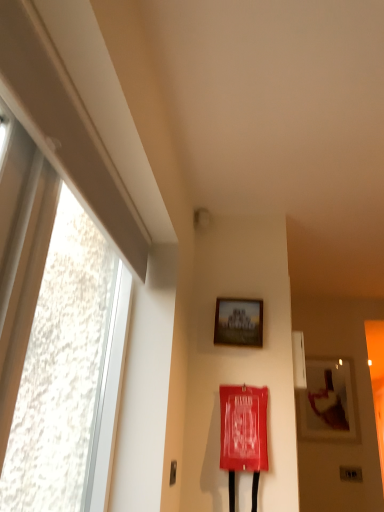
This screenshot has width=384, height=512. Describe the element at coordinates (173, 472) in the screenshot. I see `metallic silver door handle at lower left` at that location.

Where is `transparent glass window at left`? Image resolution: width=384 pixels, height=512 pixels. transparent glass window at left is located at coordinates (56, 356).

Describe the element at coordinates (56, 356) in the screenshot. The image size is (384, 512). I see `transparent glass window at left` at that location.

I want to click on matte wooden picture frame at upper center, the 2th picture frame from the right, so click(239, 322).

Locate an element on the screen. metallic silver door handle at lower left is located at coordinates tap(173, 472).

Considering the relative sizes of wooden picture frame at upper right, which is the 2th picture frame from front to back, and transparent glass window at left in the image provided, is wooden picture frame at upper right, which is the 2th picture frame from front to back, thinner than transparent glass window at left?

Correct, the width of wooden picture frame at upper right, which is the 2th picture frame from front to back, is less than that of transparent glass window at left.

Is wooden picture frame at upper right, which is counted as the 2th picture frame, starting from the left, bigger or smaller than transparent glass window at left?

Clearly, wooden picture frame at upper right, which is counted as the 2th picture frame, starting from the left, is smaller in size than transparent glass window at left.

Who is more distant, wooden picture frame at upper right, acting as the first picture frame starting from the right, or transparent glass window at left?

wooden picture frame at upper right, acting as the first picture frame starting from the right, is behind.

This screenshot has height=512, width=384. Identify the location of window that is on the left side of wooden picture frame at upper right, acting as the first picture frame starting from the back. (56, 356).

Considering the sizes of objects transparent glass window at left and wooden picture frame at upper right, which is the 2th picture frame from front to back, in the image provided, who is shorter, transparent glass window at left or wooden picture frame at upper right, which is the 2th picture frame from front to back,?

With less height is wooden picture frame at upper right, which is the 2th picture frame from front to back.

Which of these two, transparent glass window at left or wooden picture frame at upper right, placed as the 1th picture frame when sorted from bottom to top, is smaller?

wooden picture frame at upper right, placed as the 1th picture frame when sorted from bottom to top.

Is transparent glass window at left situated inside wooden picture frame at upper right, which appears as the second picture frame when viewed from the top, or outside?

transparent glass window at left is spatially situated outside wooden picture frame at upper right, which appears as the second picture frame when viewed from the top.

Would you say metallic silver door handle at lower left is to the left or to the right of wooden picture frame at upper right, acting as the first picture frame starting from the right, in the picture?

From the image, it's evident that metallic silver door handle at lower left is to the left of wooden picture frame at upper right, acting as the first picture frame starting from the right.

Can you confirm if metallic silver door handle at lower left is thinner than wooden picture frame at upper right, which is the 2th picture frame from front to back?

Correct, the width of metallic silver door handle at lower left is less than that of wooden picture frame at upper right, which is the 2th picture frame from front to back.

The image size is (384, 512). What are the coordinates of `door handle in front of the wooden picture frame at upper right, which is counted as the 2th picture frame, starting from the left` in the screenshot? It's located at [173, 472].

From the picture: From the image's perspective, which is above, metallic silver door handle at lower left or wooden picture frame at upper right, placed as the 1th picture frame when sorted from bottom to top?

metallic silver door handle at lower left, from the image's perspective.

From the image's perspective, which is above, matte wooden picture frame at upper center, the first picture frame when ordered from left to right, or wooden picture frame at upper right, which is counted as the 2th picture frame, starting from the left?

matte wooden picture frame at upper center, the first picture frame when ordered from left to right, from the image's perspective.

Can you confirm if matte wooden picture frame at upper center, the first picture frame from the top, is thinner than wooden picture frame at upper right, acting as the first picture frame starting from the back?

Incorrect, the width of matte wooden picture frame at upper center, the first picture frame from the top, is not less than that of wooden picture frame at upper right, acting as the first picture frame starting from the back.

Is the position of matte wooden picture frame at upper center, which is the 2th picture frame in back-to-front order, more distant than that of wooden picture frame at upper right, which is the 2th picture frame from front to back?

No, it is not.

Is matte wooden picture frame at upper center, which is the 2th picture frame in back-to-front order, not inside wooden picture frame at upper right, acting as the first picture frame starting from the back?

Yes.

Considering the sizes of wooden picture frame at upper right, which is the 2th picture frame from front to back, and matte wooden picture frame at upper center, the 2th picture frame from the right, in the image, is wooden picture frame at upper right, which is the 2th picture frame from front to back, wider or thinner than matte wooden picture frame at upper center, the 2th picture frame from the right,?

Clearly, wooden picture frame at upper right, which is the 2th picture frame from front to back, has less width compared to matte wooden picture frame at upper center, the 2th picture frame from the right.

Is wooden picture frame at upper right, placed as the 1th picture frame when sorted from bottom to top, not within matte wooden picture frame at upper center, which is the 1th picture frame from front to back?

Yes, wooden picture frame at upper right, placed as the 1th picture frame when sorted from bottom to top, is outside of matte wooden picture frame at upper center, which is the 1th picture frame from front to back.

Are wooden picture frame at upper right, which is the 2th picture frame from front to back, and matte wooden picture frame at upper center, the first picture frame from the top, located far from each other?

Indeed, wooden picture frame at upper right, which is the 2th picture frame from front to back, is not near matte wooden picture frame at upper center, the first picture frame from the top.

Could you tell me if wooden picture frame at upper right, which appears as the second picture frame when viewed from the top, is turned towards matte wooden picture frame at upper center, the 2th picture frame from the right?

Yes, wooden picture frame at upper right, which appears as the second picture frame when viewed from the top, is aimed at matte wooden picture frame at upper center, the 2th picture frame from the right.

Are matte wooden picture frame at upper center, which is counted as the second picture frame, starting from the bottom, and transparent glass window at left located far from each other?

No, there isn't a large distance between matte wooden picture frame at upper center, which is counted as the second picture frame, starting from the bottom, and transparent glass window at left.

From the image's perspective, which is below, matte wooden picture frame at upper center, which is the 2th picture frame in back-to-front order, or transparent glass window at left?

matte wooden picture frame at upper center, which is the 2th picture frame in back-to-front order, appears lower in the image.

Would you say matte wooden picture frame at upper center, the first picture frame from the top, is inside or outside transparent glass window at left?

matte wooden picture frame at upper center, the first picture frame from the top, is not inside transparent glass window at left, it's outside.

Is point (257, 300) farther from camera compared to point (104, 327)?

Yes, it is.

Is metallic silver door handle at lower left turned away from transparent glass window at left?

No, metallic silver door handle at lower left's orientation is not away from transparent glass window at left.

At what (x,y) coordinates should I click in order to perform the action: click on door handle below the transparent glass window at left (from the image's perspective). Please return your answer as a coordinate pair (x, y). This screenshot has height=512, width=384. Looking at the image, I should click on (173, 472).

Is metallic silver door handle at lower left positioned far away from transparent glass window at left?

That's not correct — metallic silver door handle at lower left is a little close to transparent glass window at left.

Is metallic silver door handle at lower left taller or shorter than transparent glass window at left?

metallic silver door handle at lower left is shorter than transparent glass window at left.

The image size is (384, 512). In order to click on window that appears on the left of wooden picture frame at upper right, which appears as the second picture frame when viewed from the top in this screenshot , I will do `click(56, 356)`.

The image size is (384, 512). What are the coordinates of `the 1st picture frame above the transparent glass window at left (from a real-world perspective)` in the screenshot? It's located at (327, 401).

From the image, which object appears to be nearer to metallic silver door handle at lower left, transparent glass window at left or wooden picture frame at upper right, acting as the first picture frame starting from the right?

Based on the image, transparent glass window at left appears to be nearer to metallic silver door handle at lower left.

Which object lies nearer to the anchor point matte wooden picture frame at upper center, the 2th picture frame from the right, wooden picture frame at upper right, which is the 2th picture frame from front to back, or transparent glass window at left?

Among the two, transparent glass window at left is located nearer to matte wooden picture frame at upper center, the 2th picture frame from the right.

Looking at the image, which one is located further to transparent glass window at left, metallic silver door handle at lower left or wooden picture frame at upper right, which is counted as the 2th picture frame, starting from the left?

wooden picture frame at upper right, which is counted as the 2th picture frame, starting from the left, is positioned further to the anchor transparent glass window at left.

Looking at the image, which one is located closer to wooden picture frame at upper right, placed as the 1th picture frame when sorted from bottom to top, metallic silver door handle at lower left or transparent glass window at left?

metallic silver door handle at lower left is closer to wooden picture frame at upper right, placed as the 1th picture frame when sorted from bottom to top.

Looking at the image, which one is located closer to wooden picture frame at upper right, placed as the 1th picture frame when sorted from bottom to top, transparent glass window at left or matte wooden picture frame at upper center, the first picture frame from the top?

The object closer to wooden picture frame at upper right, placed as the 1th picture frame when sorted from bottom to top, is matte wooden picture frame at upper center, the first picture frame from the top.

Estimate the real-world distances between objects in this image. Which object is closer to wooden picture frame at upper right, which is the 2th picture frame from front to back, matte wooden picture frame at upper center, which is the 1th picture frame from front to back, or metallic silver door handle at lower left?

Among the two, matte wooden picture frame at upper center, which is the 1th picture frame from front to back, is located nearer to wooden picture frame at upper right, which is the 2th picture frame from front to back.

Considering their positions, is matte wooden picture frame at upper center, which is the 1th picture frame from front to back, positioned further to transparent glass window at left than wooden picture frame at upper right, acting as the first picture frame starting from the right?

Based on the image, wooden picture frame at upper right, acting as the first picture frame starting from the right, appears to be further to transparent glass window at left.

Estimate the real-world distances between objects in this image. Which object is closer to transparent glass window at left, wooden picture frame at upper right, acting as the first picture frame starting from the back, or metallic silver door handle at lower left?

metallic silver door handle at lower left lies closer to transparent glass window at left than the other object.

This screenshot has width=384, height=512. What are the coordinates of `picture frame between metallic silver door handle at lower left and wooden picture frame at upper right, placed as the 1th picture frame when sorted from bottom to top, in the front-back direction` in the screenshot? It's located at (239, 322).

Image resolution: width=384 pixels, height=512 pixels. I want to click on door handle between transparent glass window at left and wooden picture frame at upper right, placed as the 1th picture frame when sorted from bottom to top, in the front-back direction, so click(x=173, y=472).

Image resolution: width=384 pixels, height=512 pixels. Identify the location of door handle positioned between transparent glass window at left and matte wooden picture frame at upper center, which is counted as the second picture frame, starting from the bottom, from near to far. (173, 472).

Identify the location of picture frame positioned between transparent glass window at left and wooden picture frame at upper right, which is the 2th picture frame from front to back, from near to far. Image resolution: width=384 pixels, height=512 pixels. (239, 322).